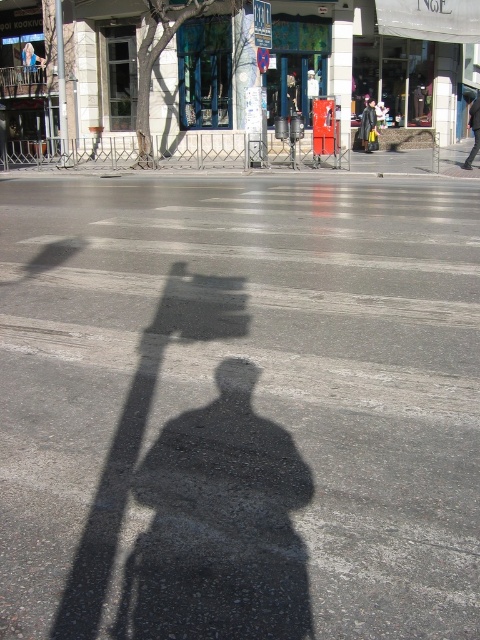
Between brushed metal pole at upper left and black leather jacket at center, which one appears on the right side from the viewer's perspective?

Positioned to the right is black leather jacket at center.

Which is in front, point (61, 138) or point (369, 122)?

Point (61, 138) is more forward.

The height and width of the screenshot is (640, 480). I want to click on brushed metal pole at upper left, so click(x=60, y=83).

Is brushed metal pole at upper left further to camera compared to dark gray pants at center?

Yes, it is behind dark gray pants at center.

Between brushed metal pole at upper left and dark gray pants at center, which one appears on the right side from the viewer's perspective?

dark gray pants at center is more to the right.

Describe the element at coordinates (60, 83) in the screenshot. I see `brushed metal pole at upper left` at that location.

The height and width of the screenshot is (640, 480). What are the coordinates of `brushed metal pole at upper left` in the screenshot? It's located at (60, 83).

Is black shadow at center to the left of metallic blue street sign at upper center from the viewer's perspective?

Yes, black shadow at center is to the left of metallic blue street sign at upper center.

Which is more to the right, black shadow at center or metallic blue street sign at upper center?

metallic blue street sign at upper center is more to the right.

Does point (134, 563) come in front of point (259, 32)?

Yes, it is.

The width and height of the screenshot is (480, 640). Identify the location of black shadow at center. (219, 525).